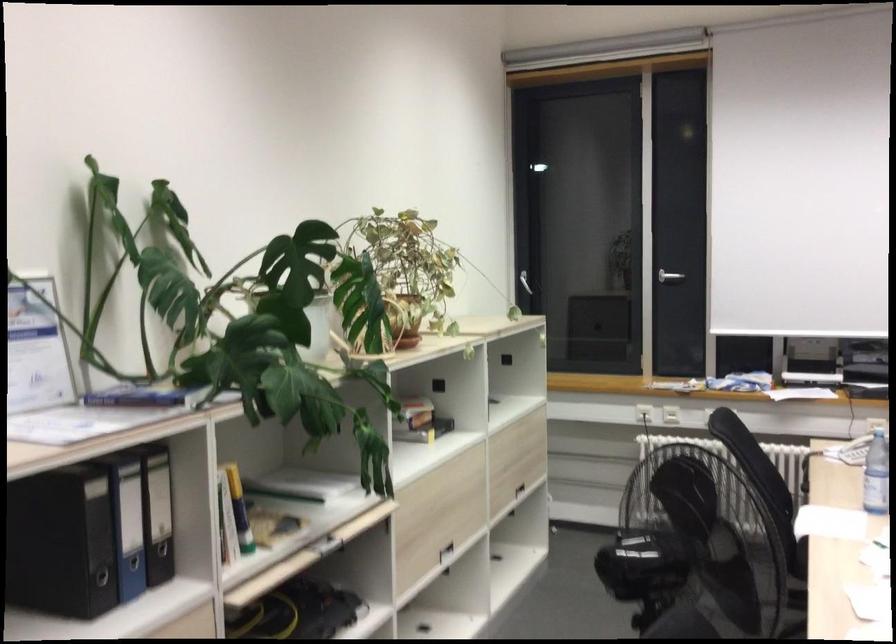
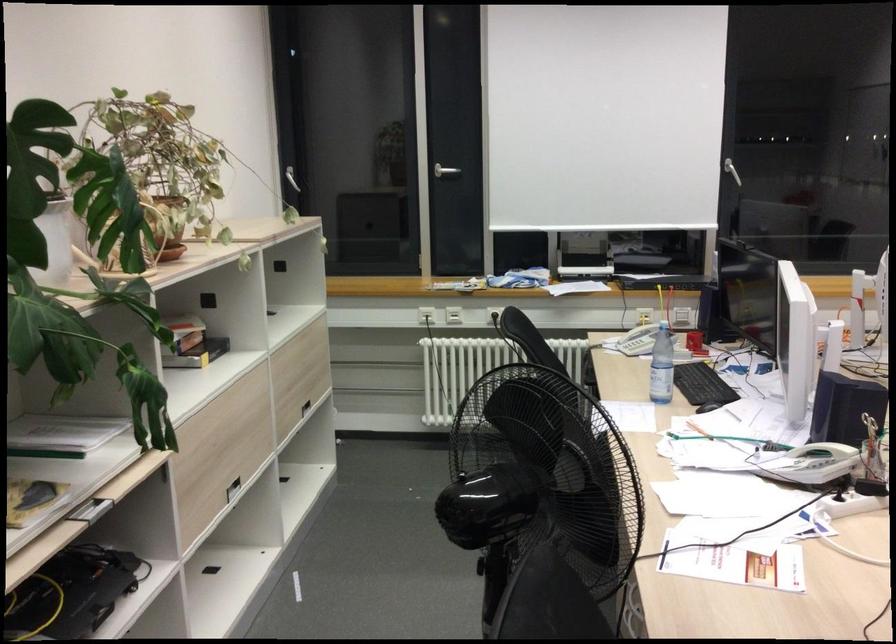
Where in the second image is the point corresponding to point 440,500 from the first image?

(225, 435)